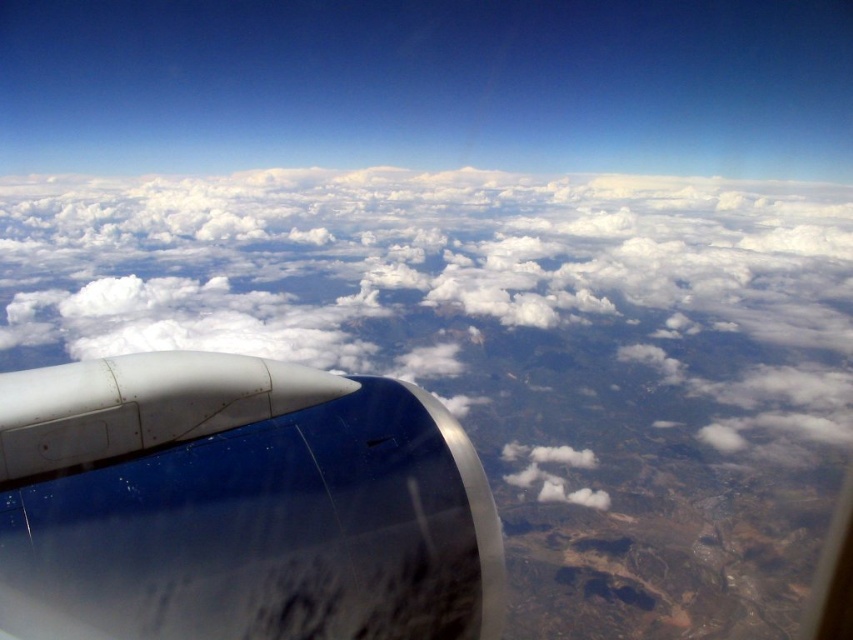
You are a pilot observing the landscape through the airplane window. You notice two points marked on the window at coordinates point (729, 445) and point (444, 472). Which point is closer to your eyes?

Point (729, 445) is further to the viewer than point (444, 472), so the point closer to your eyes is point (444, 472).

You are a pilot checking the flight path. The airplane is currently at coordinates 0.5, 0.5. Is the white fluffy cloud at center in front of or behind the airplane?

The white fluffy cloud at center is located at point (480, 307), which is slightly behind the airplane at (426, 320). Therefore, the cloud is behind the airplane.